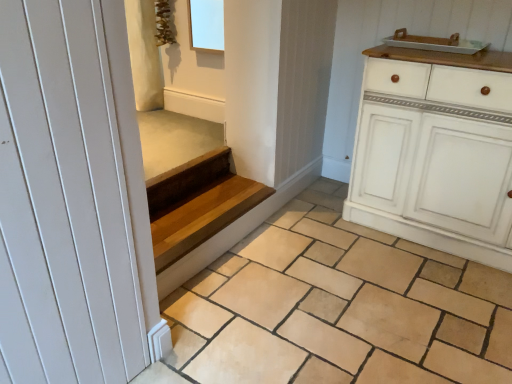
What do you see at coordinates (197, 204) in the screenshot? I see `wooden stairs at center` at bounding box center [197, 204].

What do you see at coordinates (434, 154) in the screenshot? I see `white painted wood cabinet at right` at bounding box center [434, 154].

Locate an element on the screen. The width and height of the screenshot is (512, 384). white ceramic tray at upper right is located at coordinates click(x=435, y=43).

Image resolution: width=512 pixels, height=384 pixels. I want to click on natural stone tile at center, so click(339, 307).

The height and width of the screenshot is (384, 512). Describe the element at coordinates (72, 200) in the screenshot. I see `white smooth door at left` at that location.

I want to click on wooden stairs at center, so click(x=197, y=204).

Between white ceramic tray at upper right and wooden stairs at center, which one appears on the left side from the viewer's perspective?

From the viewer's perspective, wooden stairs at center appears more on the left side.

Considering the sizes of objects white ceramic tray at upper right and wooden stairs at center in the image provided, who is shorter, white ceramic tray at upper right or wooden stairs at center?

white ceramic tray at upper right is shorter.

Would you say white ceramic tray at upper right is a long distance from wooden stairs at center?

Absolutely, white ceramic tray at upper right is distant from wooden stairs at center.

Looking at this image, which object is wider, white ceramic tray at upper right or wooden stairs at center?

wooden stairs at center.

Which of these two, white ceramic tray at upper right or white smooth door at left, is wider?

Wider between the two is white ceramic tray at upper right.

Considering the relative positions of white ceramic tray at upper right and white smooth door at left in the image provided, is white ceramic tray at upper right to the left of white smooth door at left from the viewer's perspective?

In fact, white ceramic tray at upper right is to the right of white smooth door at left.

From the image's perspective, which is above, white ceramic tray at upper right or white smooth door at left?

white ceramic tray at upper right, from the image's perspective.

In the scene shown: Can white ceramic tray at upper right be found inside wooden stairs at center?

No, white ceramic tray at upper right is not a part of wooden stairs at center.

Is point (233, 183) farther from camera compared to point (398, 36)?

Yes.

What's the angular difference between wooden stairs at center and white ceramic tray at upper right's facing directions?

There is a 91.1-degree angle between the facing directions of wooden stairs at center and white ceramic tray at upper right.

Does wooden stairs at center turn towards white ceramic tray at upper right?

No.

From the image's perspective, is white smooth door at left located above wooden stairs at center?

Yes, from the image's perspective, white smooth door at left is on top of wooden stairs at center.

Could wooden stairs at center be considered to be inside white smooth door at left?

Definitely not — wooden stairs at center is not inside white smooth door at left.

How different are the orientations of white smooth door at left and wooden stairs at center in degrees?

They differ by 1.17 degrees in their facing directions.

Considering the sizes of objects white smooth door at left and wooden stairs at center in the image provided, who is smaller, white smooth door at left or wooden stairs at center?

Smaller between the two is white smooth door at left.

Is natural stone tile at center bigger or smaller than wooden stairs at center?

In the image, natural stone tile at center appears to be larger than wooden stairs at center.

From a real-world perspective, which object stands above the other?

From a 3D spatial view, wooden stairs at center is above.

Identify the location of tile on the right of wooden stairs at center. (339, 307).

Would you say natural stone tile at center contains wooden stairs at center?

Definitely not — wooden stairs at center is not inside natural stone tile at center.

Based on the photo, is white painted wood cabinet at right inside the boundaries of white smooth door at left, or outside?

white painted wood cabinet at right is spatially situated outside white smooth door at left.

Considering the sizes of objects white painted wood cabinet at right and white smooth door at left in the image provided, who is smaller, white painted wood cabinet at right or white smooth door at left?

white smooth door at left.

Does point (450, 179) lie behind point (159, 344)?

Yes, point (450, 179) is behind point (159, 344).

Is point (196, 179) farther from viewer compared to point (2, 256)?

That is True.

From the image's perspective, is wooden stairs at center above or below white smooth door at left?

From the image's perspective, wooden stairs at center appears below white smooth door at left.

Is wooden stairs at center wider than white smooth door at left?

Yes.

This screenshot has height=384, width=512. What are the coordinates of `sink above the wooden stairs at center (from the image's perspective)` in the screenshot? It's located at (435, 43).

The width and height of the screenshot is (512, 384). What are the coordinates of `sink on the right of white smooth door at left` in the screenshot? It's located at (435, 43).

From the image, which object appears to be farther from white smooth door at left, white ceramic tray at upper right or natural stone tile at center?

white ceramic tray at upper right lies further to white smooth door at left than the other object.

Estimate the real-world distances between objects in this image. Which object is closer to white smooth door at left, white ceramic tray at upper right or wooden stairs at center?

The object closer to white smooth door at left is wooden stairs at center.

Looking at the image, which one is located further to wooden stairs at center, natural stone tile at center or white ceramic tray at upper right?

white ceramic tray at upper right is further to wooden stairs at center.

When comparing their distances from white ceramic tray at upper right, does white painted wood cabinet at right or wooden stairs at center seem closer?

Based on the image, white painted wood cabinet at right appears to be nearer to white ceramic tray at upper right.

Looking at the image, which one is located further to white ceramic tray at upper right, white smooth door at left or natural stone tile at center?

white smooth door at left is positioned further to the anchor white ceramic tray at upper right.

Based on their spatial positions, is white smooth door at left or wooden stairs at center closer to white ceramic tray at upper right?

wooden stairs at center is closer to white ceramic tray at upper right.

When comparing their distances from white ceramic tray at upper right, does natural stone tile at center or white painted wood cabinet at right seem closer?

The object closer to white ceramic tray at upper right is white painted wood cabinet at right.

Estimate the real-world distances between objects in this image. Which object is further from white ceramic tray at upper right, wooden stairs at center or natural stone tile at center?

Among the two, wooden stairs at center is located further to white ceramic tray at upper right.

At what (x,y) coordinates should I click in order to perform the action: click on sink situated between wooden stairs at center and white painted wood cabinet at right from left to right. Please return your answer as a coordinate pair (x, y). Looking at the image, I should click on (435, 43).

The image size is (512, 384). In order to click on stairs between white ceramic tray at upper right and natural stone tile at center in the up-down direction in this screenshot , I will do `click(197, 204)`.

This screenshot has width=512, height=384. I want to click on tile situated between white smooth door at left and white painted wood cabinet at right from left to right, so 339,307.

Identify the location of stairs situated between white smooth door at left and white painted wood cabinet at right from left to right. (197, 204).